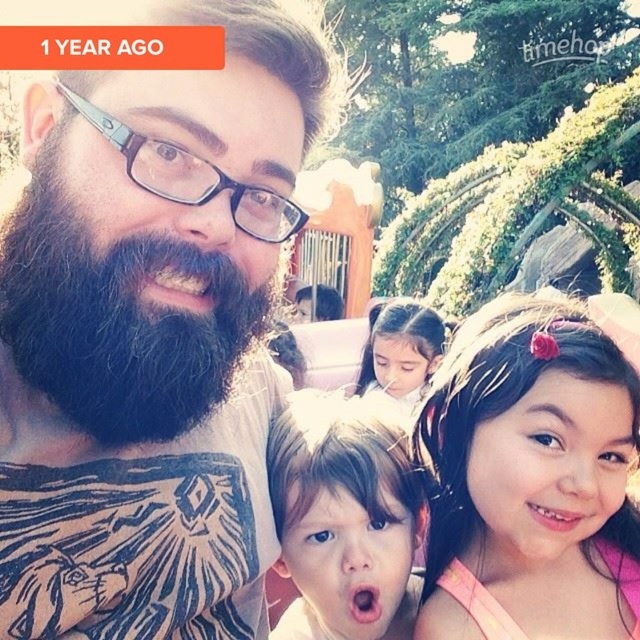
Is pink fabric at right below blackwoody/blackbeard at left?

Yes.

Which of these two, pink fabric at right or blackwoody/blackbeard at left, stands shorter?

blackwoody/blackbeard at left

Who is more distant from viewer, [582,378] or [10,276]?

Point [582,378]

You are a GUI agent. You are given a task and a screenshot of the screen. Output one action in this format:
    pyautogui.click(x=<x>, y=<y>)
    Task: Click on the pink fabric at right
    The image size is (640, 640).
    Given the screenshot: What is the action you would take?
    pyautogui.click(x=531, y=477)

Looking at this image, does pink fabric at right have a larger size compared to smooth skin face at center?

Correct, pink fabric at right is larger in size than smooth skin face at center.

Who is higher up, pink fabric at right or smooth skin face at center?

pink fabric at right is higher up.

Measure the distance between point (419, 412) and camera.

Point (419, 412) is 2.46 meters from camera.

Image resolution: width=640 pixels, height=640 pixels. Identify the location of pink fabric at right. (531, 477).

Does smooth skin face at center have a larger size compared to smooth skin girl at center?

Actually, smooth skin face at center might be smaller than smooth skin girl at center.

In the scene shown: Who is more distant from viewer, (371, 632) or (401, 394)?

Point (401, 394)

Find the location of a particular element. The height and width of the screenshot is (640, 640). smooth skin face at center is located at coordinates (342, 513).